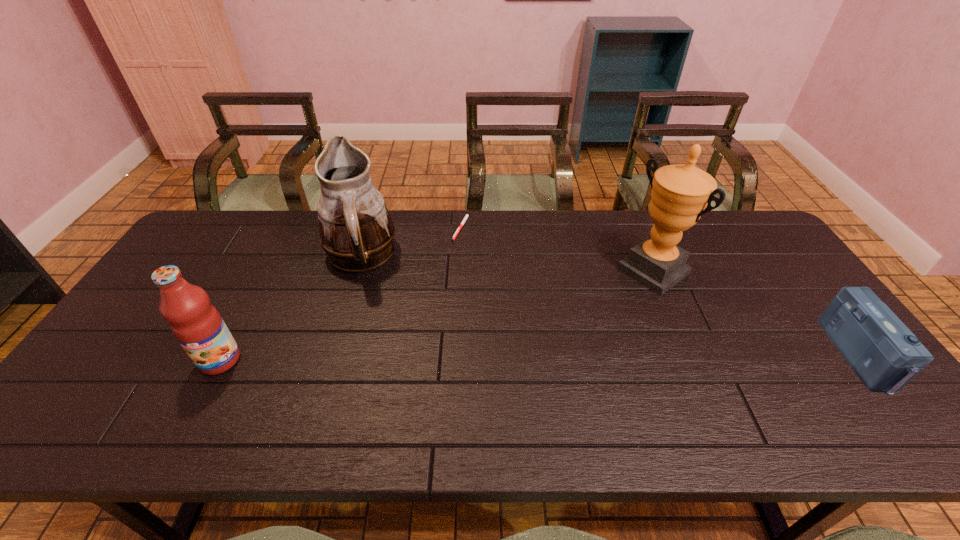
The width and height of the screenshot is (960, 540). Find the location of `fruit juice`. fruit juice is located at coordinates (197, 325).

The height and width of the screenshot is (540, 960). In order to click on the leftmost object in this screenshot , I will do `click(197, 325)`.

Identify the location of the fourth tallest object. (885, 355).

Image resolution: width=960 pixels, height=540 pixels. I want to click on camera, so (885, 355).

Find the location of a particular element. This screenshot has height=540, width=960. the third object from right to left is located at coordinates (465, 218).

Image resolution: width=960 pixels, height=540 pixels. I want to click on the shortest object, so click(x=465, y=218).

Where is `the fourth shortest object`? The image size is (960, 540). the fourth shortest object is located at coordinates (356, 232).

Where is `the second object from left to right`? the second object from left to right is located at coordinates (356, 232).

The height and width of the screenshot is (540, 960). Identify the location of award. (680, 193).

You are a GUI agent. You are given a task and a screenshot of the screen. Output one action in this format:
    pyautogui.click(x=<x>, y=<y>)
    Task: Click on the free spot located on the clicker of the third object from left to right
    The width and height of the screenshot is (960, 540).
    Given the screenshot: What is the action you would take?
    pyautogui.click(x=471, y=269)